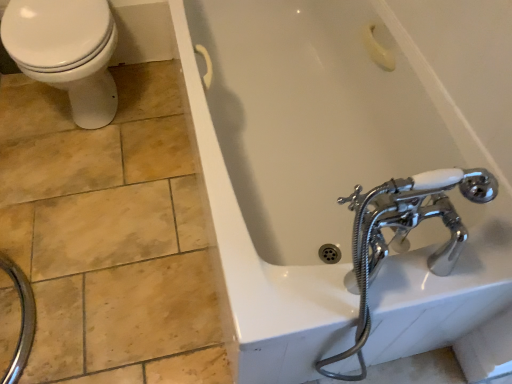
Question: From the image's perspective, relative to white glossy bathtub at upper center, is white glossy toilet at upper left above or below?

Choices:
 (A) below
 (B) above

Answer: (B)

Question: Is white glossy toilet at upper left to the left or to the right of white glossy bathtub at upper center in the image?

Choices:
 (A) left
 (B) right

Answer: (A)

Question: Is white glossy toilet at upper left bigger or smaller than white glossy bathtub at upper center?

Choices:
 (A) big
 (B) small

Answer: (B)

Question: From the image's perspective, relative to white glossy toilet at upper left, is white glossy bathtub at upper center above or below?

Choices:
 (A) below
 (B) above

Answer: (A)

Question: From a real-world perspective, is white glossy bathtub at upper center physically located above or below white glossy toilet at upper left?

Choices:
 (A) below
 (B) above

Answer: (A)

Question: Considering the positions of white glossy bathtub at upper center and white glossy toilet at upper left in the image, is white glossy bathtub at upper center taller or shorter than white glossy toilet at upper left?

Choices:
 (A) tall
 (B) short

Answer: (B)

Question: Choose the correct answer: Is white glossy bathtub at upper center inside white glossy toilet at upper left or outside it?

Choices:
 (A) outside
 (B) inside

Answer: (A)